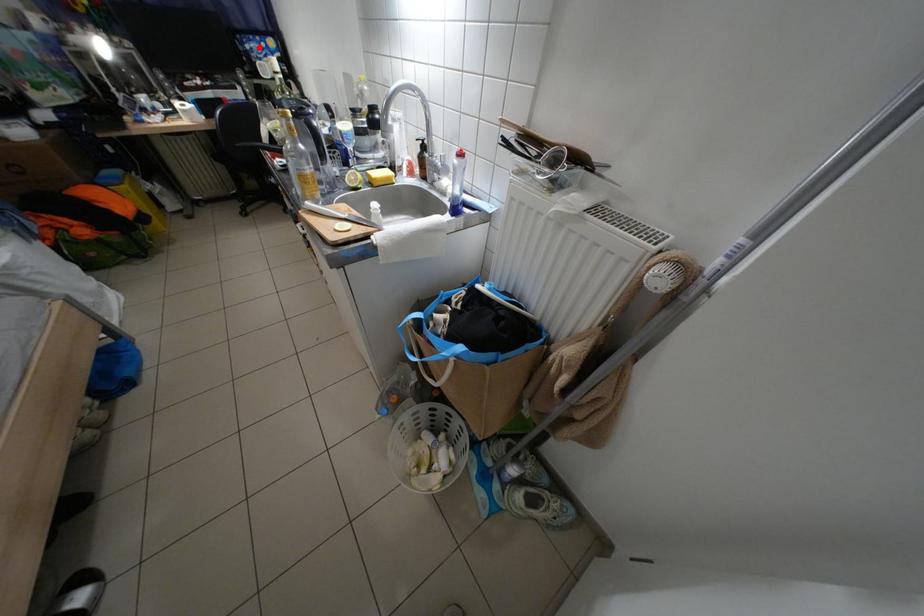
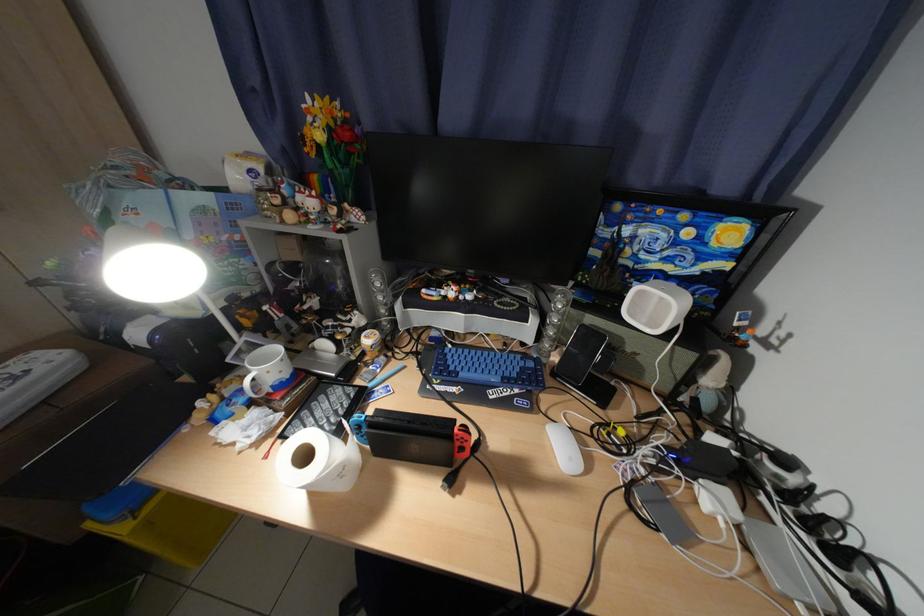
Question: I am providing you with two images of the same scene from different viewpoints. Given a red point in image1, look at the same physical point in image2. Is it:

Choices:
 (A) Closer to the viewpoint
 (B) Farther from the viewpoint

Answer: (A)